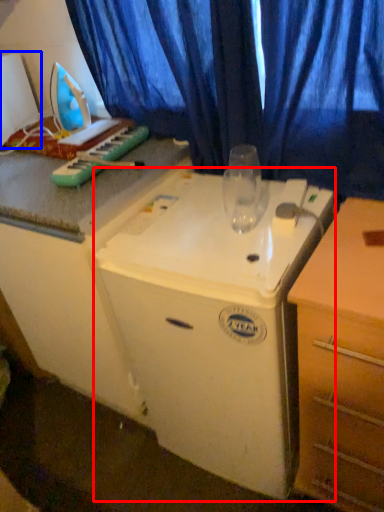
Question: Which object is closer to the camera taking this photo, appliance (highlighted by a red box) or appliance (highlighted by a blue box)?

Choices:
 (A) appliance
 (B) appliance

Answer: (A)